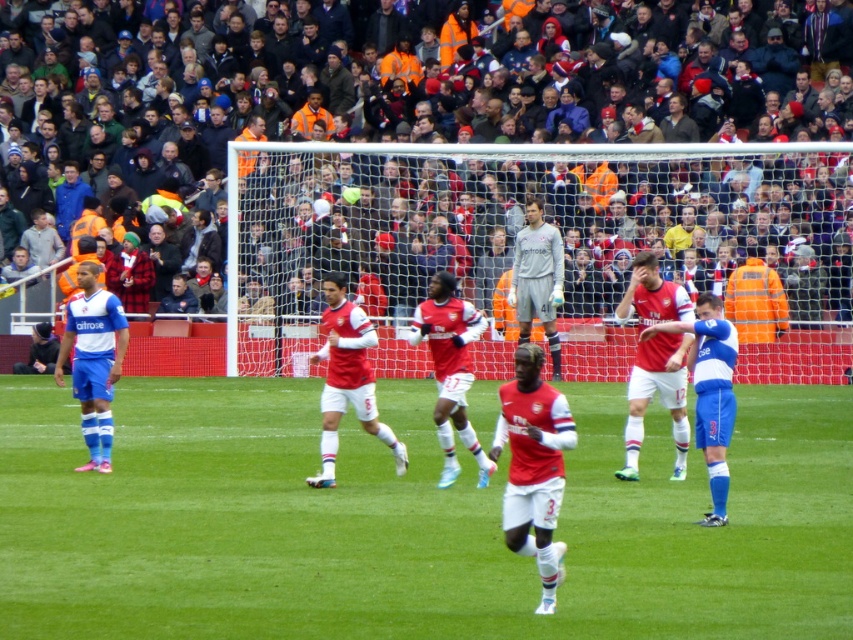
Question: Is red matte jersey at center below gray matte jersey at center?

Choices:
 (A) yes
 (B) no

Answer: (A)

Question: Considering the real-world distances, which object is closest to the green grass football field at center?

Choices:
 (A) gray matte jersey at center
 (B) blue jersey at left
 (C) matte red soccer ball at center

Answer: (B)

Question: Which is farther from the green grass football field at center?

Choices:
 (A) matte red soccer ball at center
 (B) matte red jersey at center
 (C) gray matte jersey at center
 (D) blue jersey at left

Answer: (C)

Question: In this image, where is red matte jersey at center located relative to matte red jersey at center?

Choices:
 (A) above
 (B) below

Answer: (B)

Question: Is textured fabric crowd at upper center wider than gray matte jersey at center?

Choices:
 (A) no
 (B) yes

Answer: (B)

Question: Among these points, which one is farthest from the camera?

Choices:
 (A) (544, 248)
 (B) (514, 413)

Answer: (A)